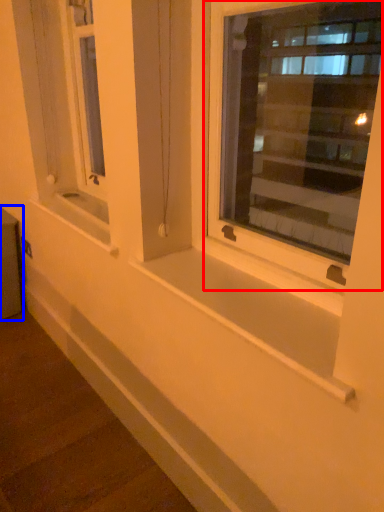
Question: Which object is closer to the camera taking this photo, window (highlighted by a red box) or window box (highlighted by a blue box)?

Choices:
 (A) window
 (B) window box

Answer: (A)